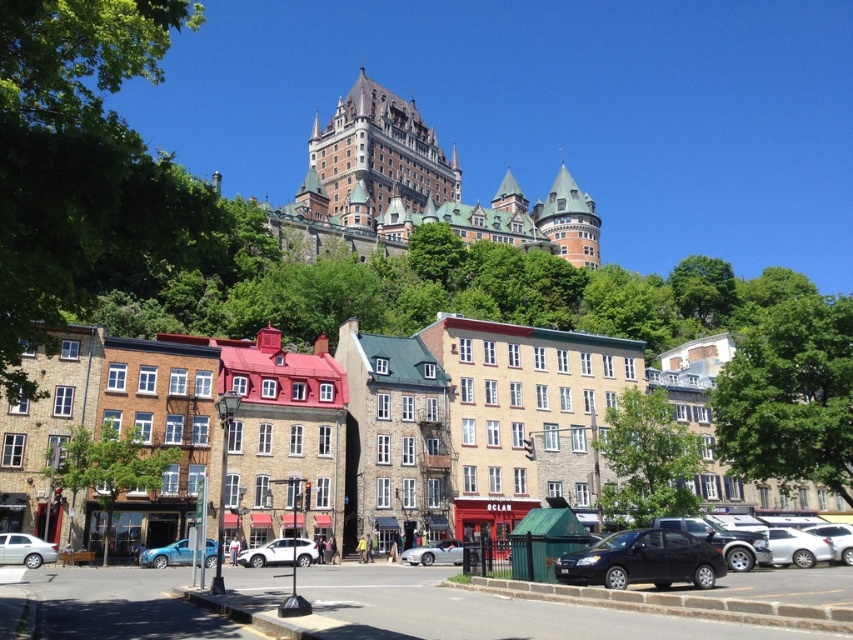
You are a delivery person trying to park your white matte car at center in a spot that requires squeezing between two parked vehicles. The space between the green leafy tree at upper left and the next car is 1.8 meters. Can your car fit if it is 1.9 meters wide?

The space between the green leafy tree at upper left and the next car is 1.8 meters, which is narrower than your car width of 1.9 meters. Therefore, your car cannot fit into that space.

You are a tourist standing on the street and want to take a photo of the Chateaux Frontenac in the background. You notice a green leafy tree at upper left and a white matte car at center. Which object would block your view more if you stand in front of them?

The green leafy tree at upper left is much taller than the white matte car at center, so it would block your view more if you stand in front of them.

Based on the scene description, where are the stone buildings at center located in terms of their 2D coordinates?

The stone buildings at center are located at the 2D coordinates of point (323, 424).